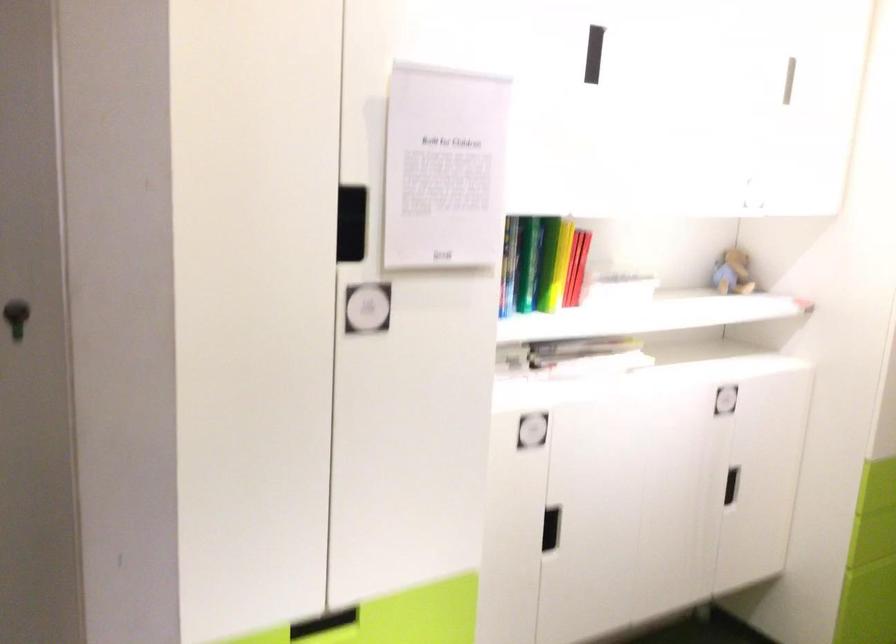
Where is `black locker lock`? The image size is (896, 644). black locker lock is located at coordinates (15, 317).